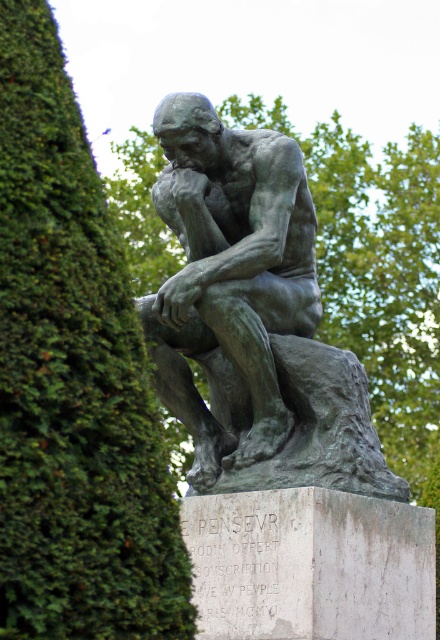
Question: Does green mossy hedge at left have a larger size compared to bronze statue at center?

Choices:
 (A) no
 (B) yes

Answer: (A)

Question: Which point appears closest to the camera in this image?

Choices:
 (A) (69, 269)
 (B) (252, 435)

Answer: (A)

Question: Which of the following is the farthest from the observer?

Choices:
 (A) (154, 588)
 (B) (264, 321)

Answer: (B)

Question: Where is green mossy hedge at left located in relation to bronze statue at center in the image?

Choices:
 (A) right
 (B) left

Answer: (B)

Question: Is green mossy hedge at left behind bronze statue at center?

Choices:
 (A) no
 (B) yes

Answer: (A)